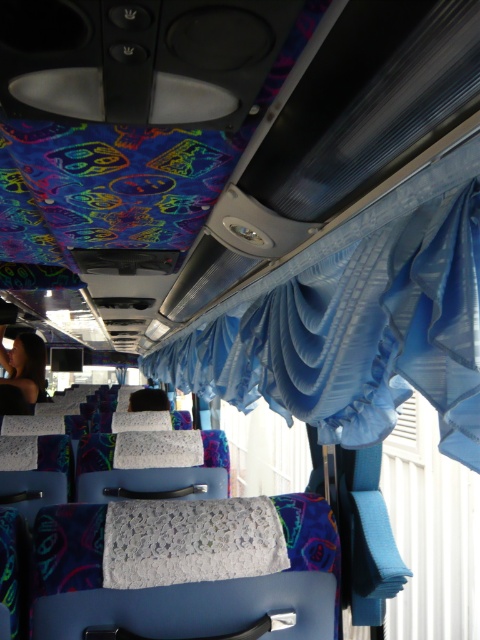
You are a passenger on the bus and want to block out the sunlight coming through the windows. Which of the two items, the blue satin curtain at upper center or the white lace cloth at center, would be more effective in blocking the light?

The blue satin curtain at upper center is larger in size compared to the white lace cloth at center, making it more effective in blocking sunlight.

You are a passenger on the bus and want to know if the white lace cloth at center can completely cover the dark hair at left. Based on their sizes, can it?

The white lace cloth at center is not as tall as dark hair at left, so it cannot completely cover the dark hair at left.

You are a passenger on the bus and want to check the outside view. There is a blue satin curtain at upper center. Where should you move to see through it?

The blue satin curtain at upper center is located at point [357,333], so you should move to the upper center area of the bus near those coordinates to see through it.